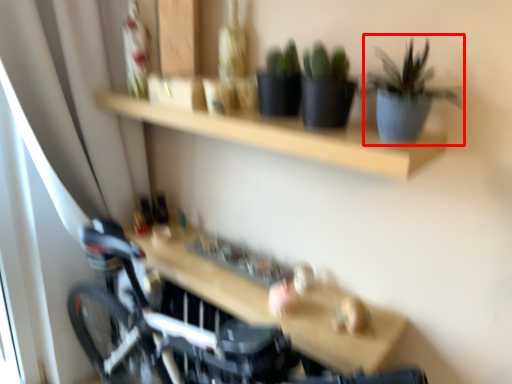
Question: From the image's perspective, what is the correct spatial relationship of houseplant (annotated by the red box) in relation to table?

Choices:
 (A) above
 (B) below

Answer: (A)